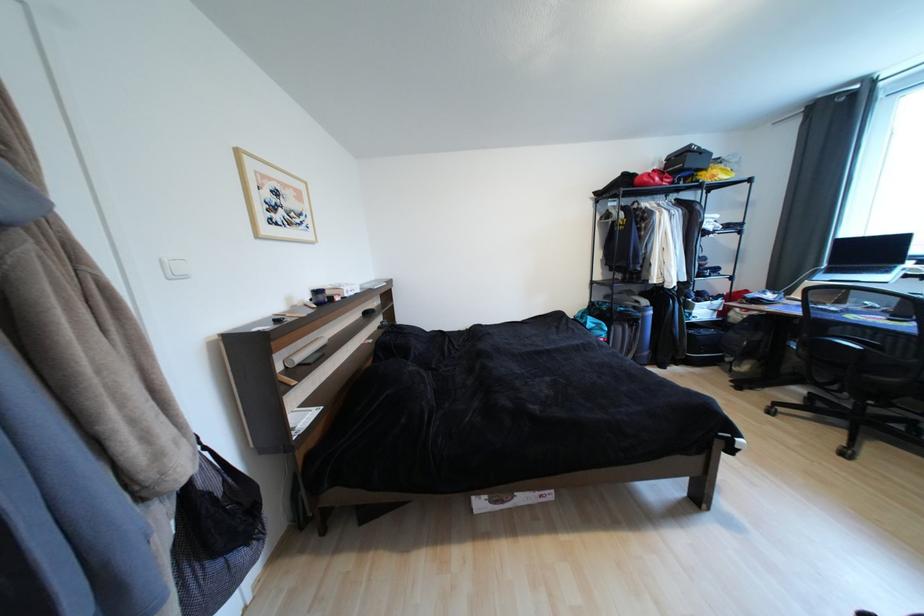
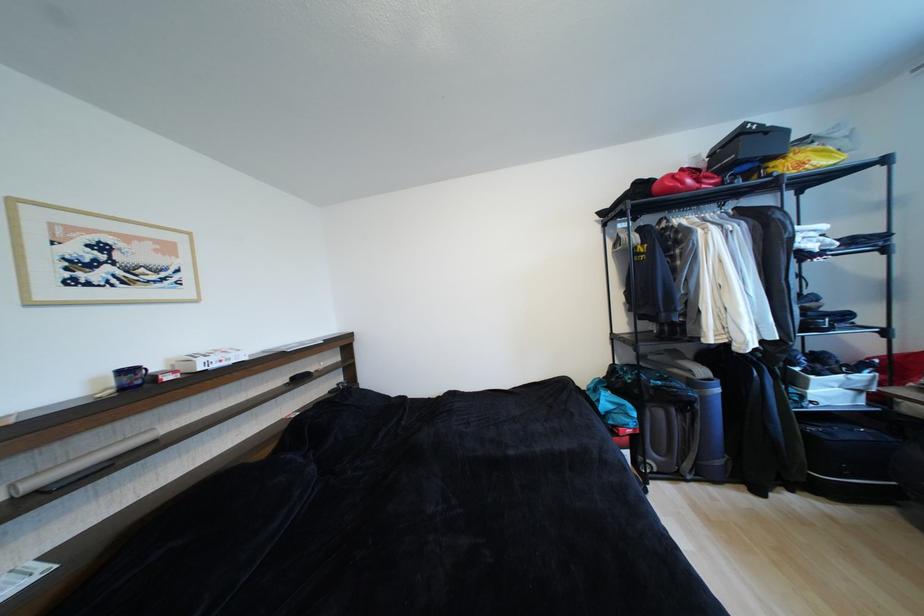
Where in the second image is the point corresponding to point 323,294 from the first image?

(134, 373)